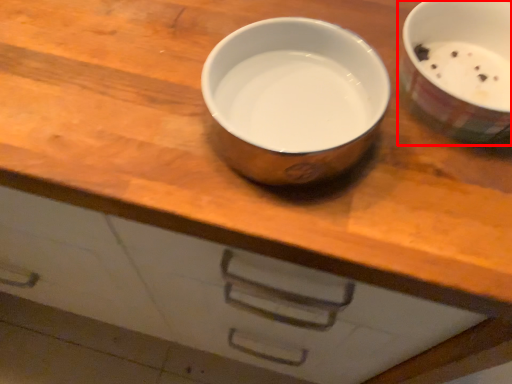
Question: From the image's perspective, what is the correct spatial relationship of tableware (annotated by the red box) in relation to tableware?

Choices:
 (A) above
 (B) below

Answer: (A)